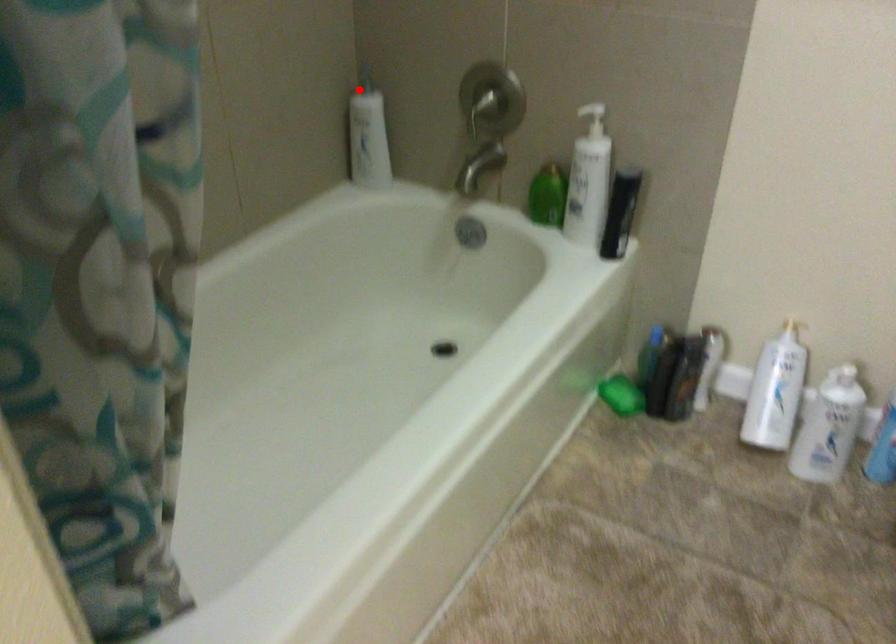
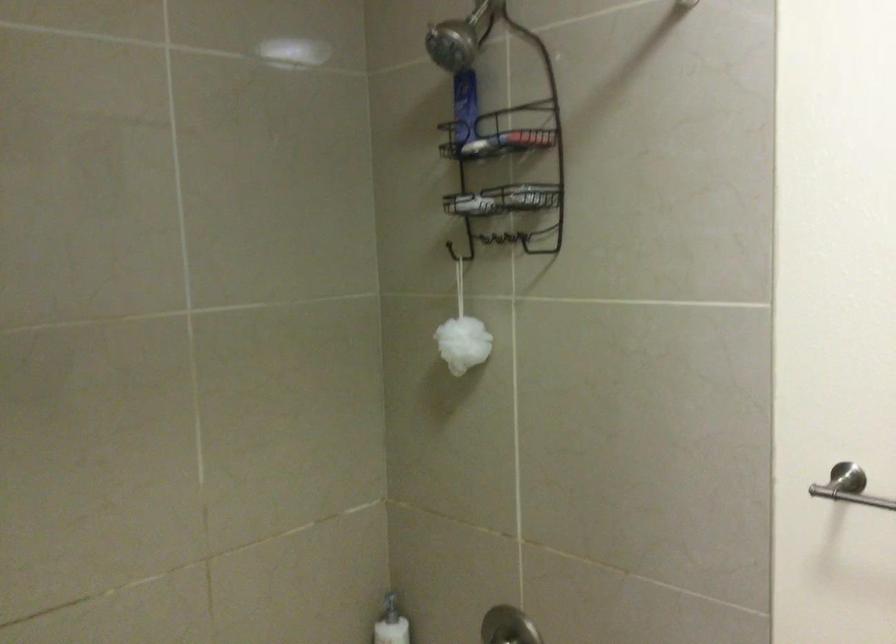
The point at the highlighted location is marked in the first image. Where is the corresponding point in the second image?

(389, 605)